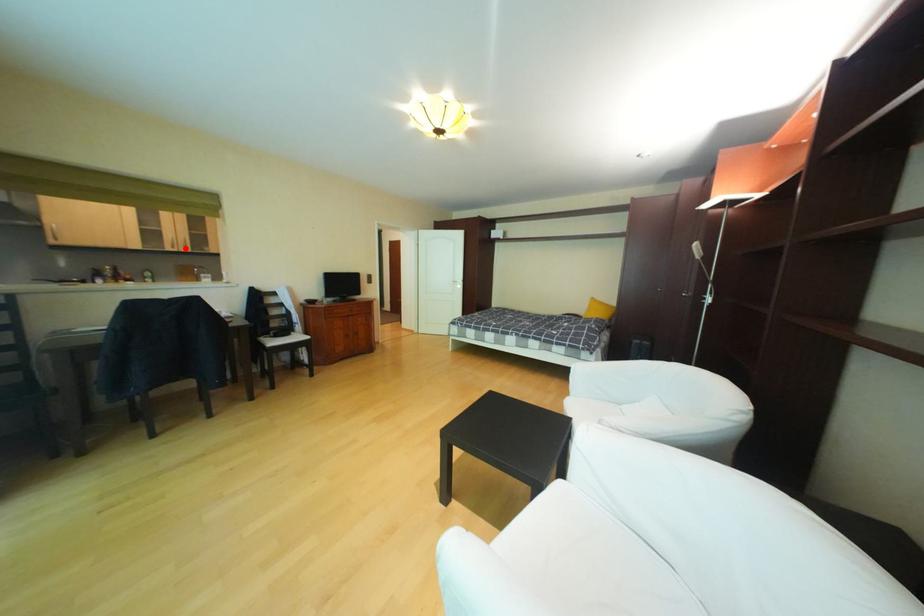
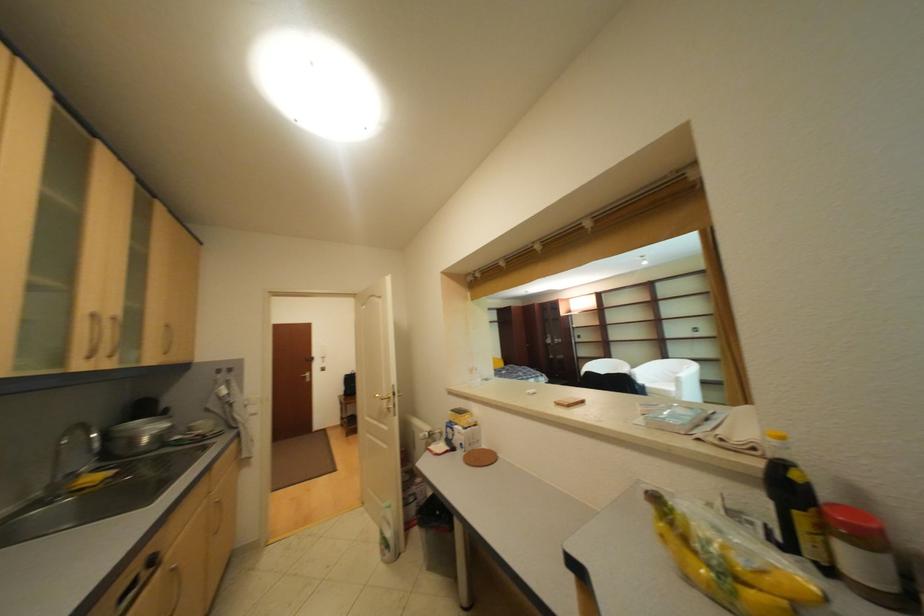
The point at the highlighted location is marked in the first image. Where is the corresponding point in the second image?

(101, 359)